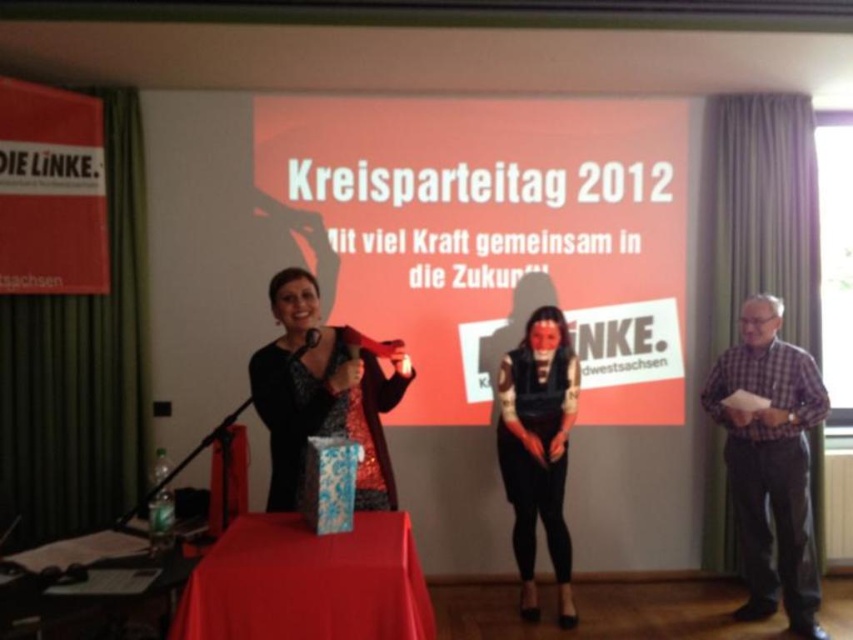
Question: Which object appears farthest from the camera in this image?

Choices:
 (A) smooth red tablecloth at center
 (B) plaid fabric shirt at right
 (C) smooth wooden table at lower left

Answer: (B)

Question: Which object is the farthest from the plaid fabric shirt at right?

Choices:
 (A) smooth red tablecloth at center
 (B) black sequined dress at center
 (C) matte black mask at center
 (D) smooth wooden table at lower left

Answer: (D)

Question: Which of the following is the closest to the observer?

Choices:
 (A) smooth red tablecloth at center
 (B) black sequined dress at center
 (C) matte black mask at center
 (D) smooth wooden table at lower left

Answer: (D)

Question: Is plaid fabric shirt at right above black sequined dress at center?

Choices:
 (A) yes
 (B) no

Answer: (B)

Question: Considering the relative positions of matte black mask at center and smooth wooden table at lower left in the image provided, where is matte black mask at center located with respect to smooth wooden table at lower left?

Choices:
 (A) above
 (B) below

Answer: (A)

Question: Considering the relative positions of smooth red tablecloth at center and black sequined dress at center in the image provided, where is smooth red tablecloth at center located with respect to black sequined dress at center?

Choices:
 (A) right
 (B) left

Answer: (A)